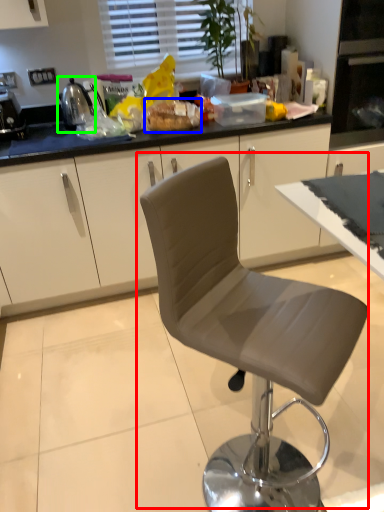
Question: Estimate the real-world distances between objects in this image. Which object is closer to chair (highlighted by a red box), food (highlighted by a blue box) or appliance (highlighted by a green box)?

Choices:
 (A) food
 (B) appliance

Answer: (A)